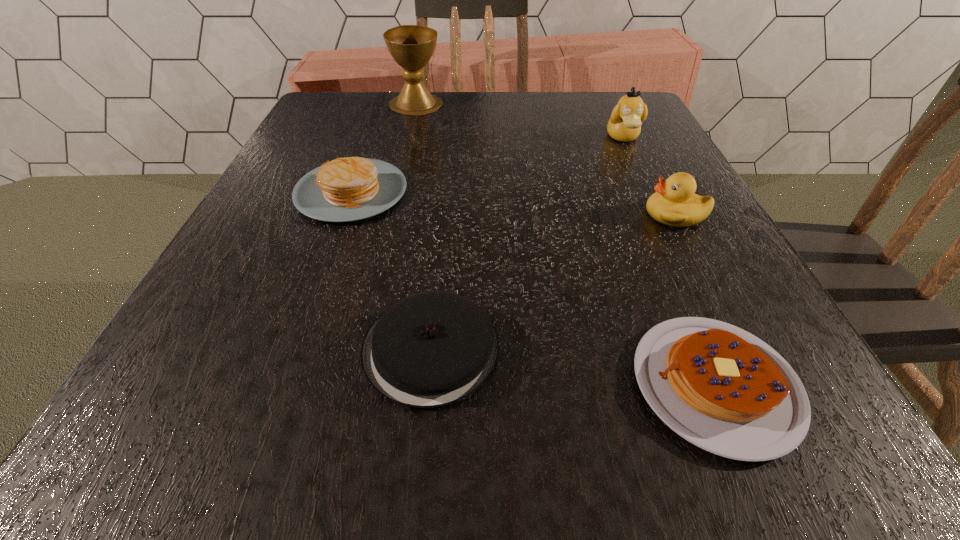
At what (x,y) coordinates should I click in order to perform the action: click on chalice. Please return your answer as a coordinate pair (x, y). Looking at the image, I should click on (411, 46).

The image size is (960, 540). In order to click on the farthest object in this screenshot , I will do `click(411, 46)`.

The width and height of the screenshot is (960, 540). What are the coordinates of `the farther duckling` in the screenshot? It's located at click(x=626, y=119).

This screenshot has height=540, width=960. Identify the location of the taller duckling. (626, 119).

Identify the location of the shorter duckling. (674, 204).

At what (x,y) coordinates should I click in order to perform the action: click on the fourth shortest object. Please return your answer as a coordinate pair (x, y). Image resolution: width=960 pixels, height=540 pixels. Looking at the image, I should click on (674, 204).

Where is `the farthest pancake`? This screenshot has width=960, height=540. the farthest pancake is located at coordinates (347, 189).

Find the location of a particular element. Image resolution: width=960 pixels, height=540 pixels. the shortest object is located at coordinates (721, 388).

In order to click on the rightmost pancake in this screenshot , I will do (x=721, y=388).

Find the location of a particular element. Image resolution: width=960 pixels, height=540 pixels. vacant space located 0.190m on the front of the farthest object is located at coordinates (404, 156).